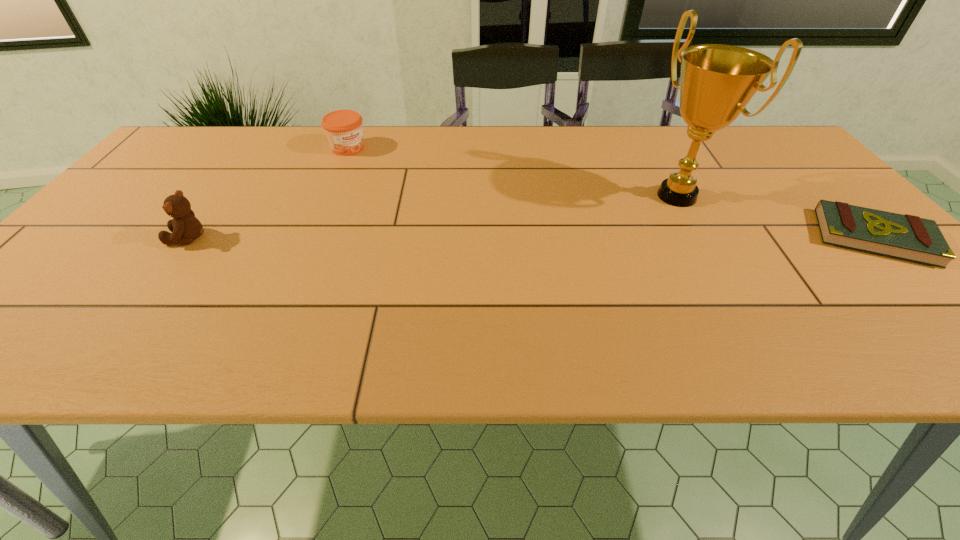
This screenshot has width=960, height=540. What are the coordinates of `vacant space on the desktop that is between the teddy bear and the book and is positioned on the front view with handles of the tallest object` in the screenshot? It's located at [594, 238].

The image size is (960, 540). I want to click on vacant space on the desktop that is between the teddy bear and the book and is positioned on the front label of the third object from right to left, so click(465, 238).